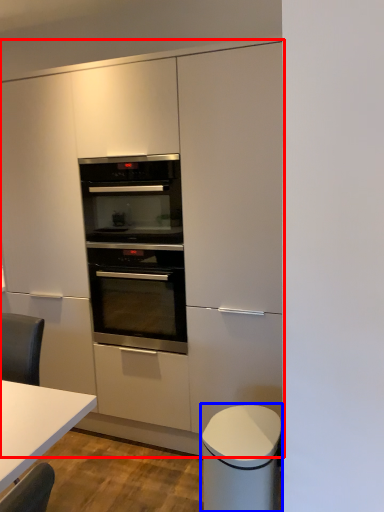
Question: Which object is closer to the camera taking this photo, cabinetry (highlighted by a red box) or cabinetry (highlighted by a blue box)?

Choices:
 (A) cabinetry
 (B) cabinetry

Answer: (B)